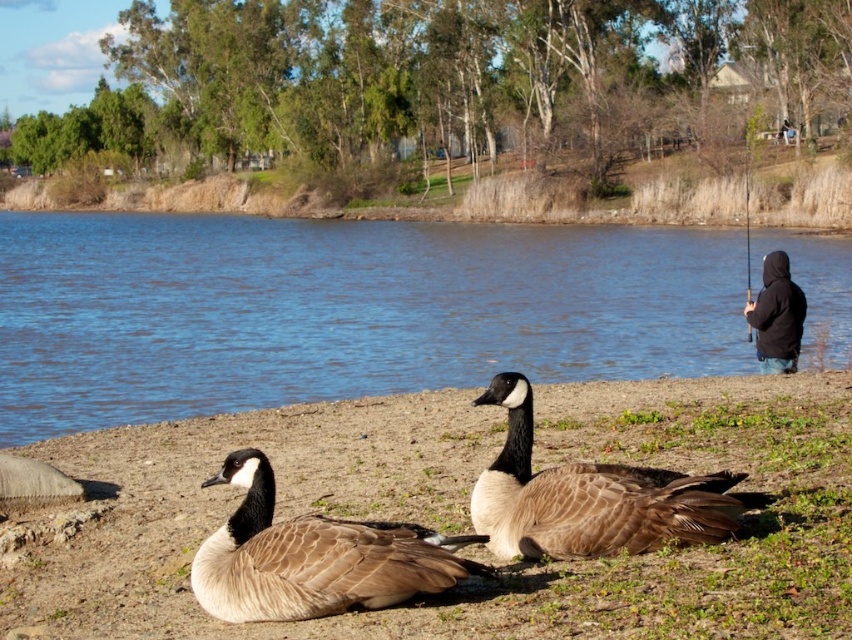
Which is more to the left, blue water at center or black hoodie at right?

Positioned to the left is blue water at center.

Between blue water at center and black hoodie at right, which one has more height?

With more height is blue water at center.

The image size is (852, 640). Describe the element at coordinates (340, 310) in the screenshot. I see `blue water at center` at that location.

Locate an element on the screen. This screenshot has width=852, height=640. blue water at center is located at coordinates (340, 310).

Measure the distance from brown feathered goose at center to black hoodie at right.

brown feathered goose at center and black hoodie at right are 30.65 feet apart.

Can you confirm if brown feathered goose at center is bigger than black hoodie at right?

No.

Find the location of `brown feathered goose at center`. brown feathered goose at center is located at coordinates (591, 497).

Is point (419, 557) positioned before point (786, 352)?

Yes.

In the scene shown: Does brown matte duck at lower center have a larger size compared to black hoodie at right?

No, brown matte duck at lower center is not bigger than black hoodie at right.

Identify the location of brown matte duck at lower center. The height and width of the screenshot is (640, 852). (314, 556).